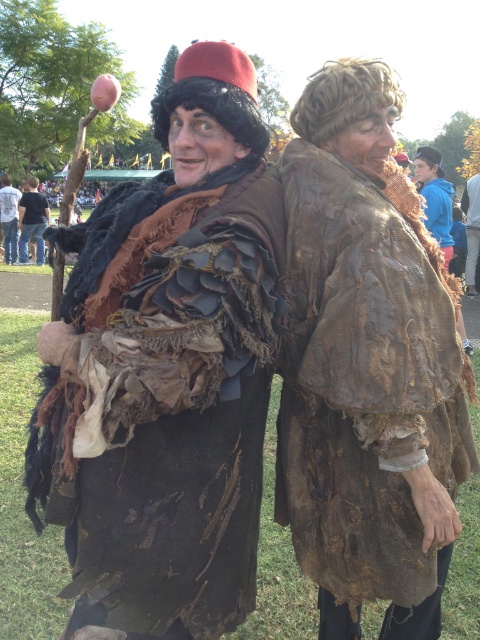
Is rusty fabric cloak at center below brown textured fabric at center?

No, rusty fabric cloak at center is not below brown textured fabric at center.

Consider the image. Is rusty fabric cloak at center bigger than brown textured fabric at center?

Yes.

I want to click on rusty fabric cloak at center, so click(x=167, y=404).

Where is `rusty fabric cloak at center`? Image resolution: width=480 pixels, height=640 pixels. rusty fabric cloak at center is located at coordinates (167, 404).

Which of these two, blue fleece jacket at right or rusty fabric coat at center, stands shorter?

blue fleece jacket at right

Can you confirm if blue fleece jacket at right is positioned above rusty fabric coat at center?

Incorrect, blue fleece jacket at right is not positioned above rusty fabric coat at center.

Who is more distant from viewer, (450, 237) or (9, 234)?

The point (9, 234) is more distant.

I want to click on blue fleece jacket at right, so click(x=434, y=198).

Is point (294, 332) behind point (6, 188)?

No, it is not.

Does brown textured fabric at center have a lesser width compared to rusty fabric coat at center?

Indeed, brown textured fabric at center has a lesser width compared to rusty fabric coat at center.

Who is more forward, [396,388] or [3,216]?

Positioned in front is point [396,388].

The image size is (480, 640). Find the location of `brown textured fabric at center`. brown textured fabric at center is located at coordinates (363, 394).